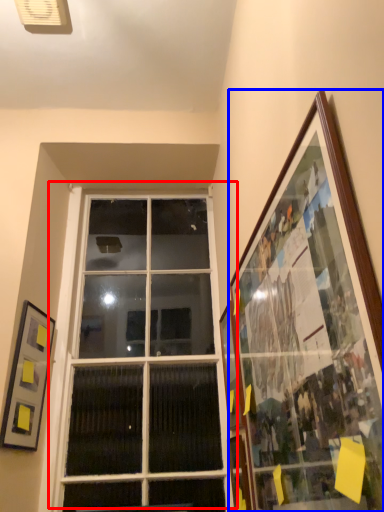
Question: Which object appears closest to the camera in this image, window (highlighted by a red box) or picture frame (highlighted by a blue box)?

Choices:
 (A) window
 (B) picture frame

Answer: (B)